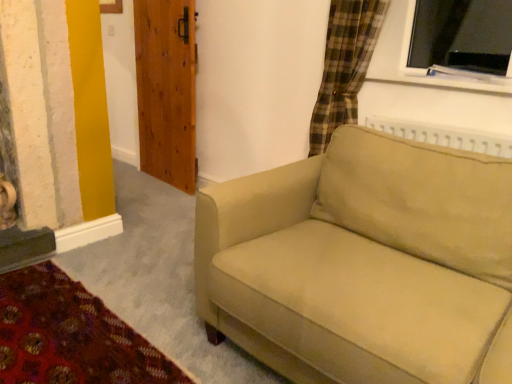
The height and width of the screenshot is (384, 512). Find the location of `beige fabric couch at center`. beige fabric couch at center is located at coordinates (364, 263).

Describe the element at coordinates (364, 263) in the screenshot. This screenshot has width=512, height=384. I see `beige fabric couch at center` at that location.

What is the approximate width of wooden door at upper left?

It is 5.60 inches.

I want to click on wooden door at upper left, so click(x=166, y=90).

Image resolution: width=512 pixels, height=384 pixels. What do you see at coordinates (166, 90) in the screenshot? I see `wooden door at upper left` at bounding box center [166, 90].

Locate an element on the screen. Image resolution: width=512 pixels, height=384 pixels. beige fabric couch at center is located at coordinates (364, 263).

Considering the relative positions of beige fabric couch at center and wooden door at upper left in the image provided, is beige fabric couch at center to the left or to the right of wooden door at upper left?

beige fabric couch at center is to the right of wooden door at upper left.

Is beige fabric couch at center behind wooden door at upper left?

No, the depth of beige fabric couch at center is less than that of wooden door at upper left.

Is point (362, 267) behind point (156, 157)?

That is False.

From the image's perspective, which object appears higher, beige fabric couch at center or wooden door at upper left?

wooden door at upper left appears higher in the image.

From a real-world perspective, who is located higher, beige fabric couch at center or wooden door at upper left?

wooden door at upper left, from a real-world perspective.

Which object is wider, beige fabric couch at center or wooden door at upper left?

beige fabric couch at center is wider.

Looking at this image, in terms of height, does beige fabric couch at center look taller or shorter compared to wooden door at upper left?

Considering their sizes, beige fabric couch at center has less height than wooden door at upper left.

In terms of size, does beige fabric couch at center appear bigger or smaller than wooden door at upper left?

Clearly, beige fabric couch at center is larger in size than wooden door at upper left.

Is beige fabric couch at center spatially inside wooden door at upper left, or outside of it?

beige fabric couch at center is located beyond the bounds of wooden door at upper left.

Would you consider beige fabric couch at center to be distant from wooden door at upper left?

Yes.

Is wooden door at upper left at the back of beige fabric couch at center?

That's not correct — beige fabric couch at center is not looking away from wooden door at upper left.

How far apart are beige fabric couch at center and wooden door at upper left?

beige fabric couch at center is 1.77 meters away from wooden door at upper left.

The width and height of the screenshot is (512, 384). What are the coordinates of `door located on the left of beige fabric couch at center` in the screenshot? It's located at (166, 90).

From the picture: Which is more to the left, wooden door at upper left or beige fabric couch at center?

wooden door at upper left is more to the left.

Considering the positions of objects wooden door at upper left and beige fabric couch at center in the image provided, who is behind, wooden door at upper left or beige fabric couch at center?

wooden door at upper left is further away from the camera.

Which is behind, point (194, 100) or point (439, 162)?

The point (194, 100) is farther from the camera.

From the image's perspective, which object appears higher, wooden door at upper left or beige fabric couch at center?

wooden door at upper left, from the image's perspective.

From a real-world perspective, which object stands above the other?

wooden door at upper left, from a real-world perspective.

Can you confirm if wooden door at upper left is thinner than beige fabric couch at center?

Yes, wooden door at upper left is thinner than beige fabric couch at center.

Is wooden door at upper left taller or shorter than beige fabric couch at center?

Clearly, wooden door at upper left is taller compared to beige fabric couch at center.

Which of these two, wooden door at upper left or beige fabric couch at center, is bigger?

Bigger between the two is beige fabric couch at center.

Which is correct: wooden door at upper left is inside beige fabric couch at center, or outside of it?

wooden door at upper left exists outside the volume of beige fabric couch at center.

Are wooden door at upper left and beige fabric couch at center located far from each other?

That's right, there is a large distance between wooden door at upper left and beige fabric couch at center.

Based on the photo, is wooden door at upper left looking in the opposite direction of beige fabric couch at center?

That's not correct — wooden door at upper left is not looking away from beige fabric couch at center.

How far apart are wooden door at upper left and beige fabric couch at center?

wooden door at upper left and beige fabric couch at center are 5.81 feet apart from each other.

Image resolution: width=512 pixels, height=384 pixels. Identify the location of studio couch lying on the right of wooden door at upper left. (364, 263).

Locate an element on the screen. door to the left of beige fabric couch at center is located at coordinates (166, 90).

This screenshot has height=384, width=512. What are the coordinates of `studio couch beneath the wooden door at upper left (from a real-world perspective)` in the screenshot? It's located at (364, 263).